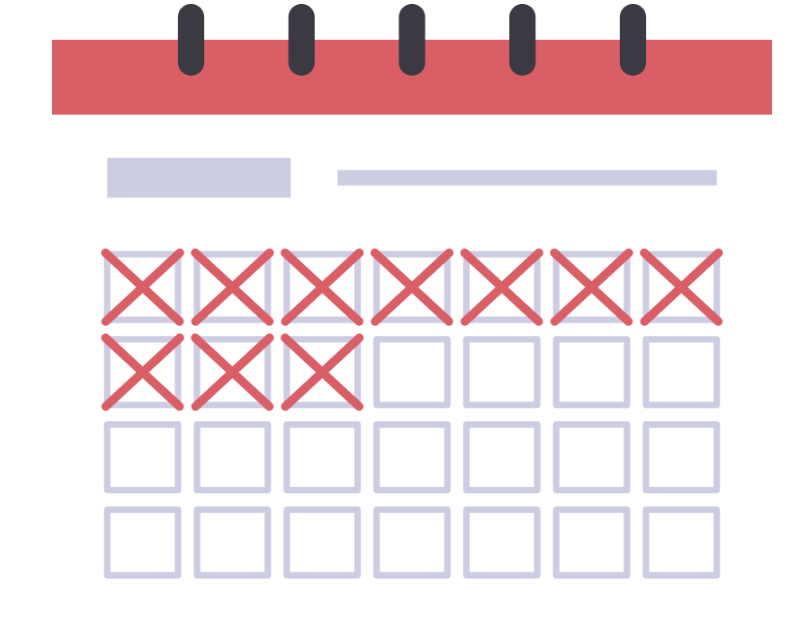
At what (x,y) coordinates should I click in order to perform the action: click on binder rings. Please return your answer as a coordinate pair (x, y). Image resolution: width=796 pixels, height=644 pixels. Looking at the image, I should click on (193, 33), (298, 41), (408, 30), (517, 38), (623, 33).